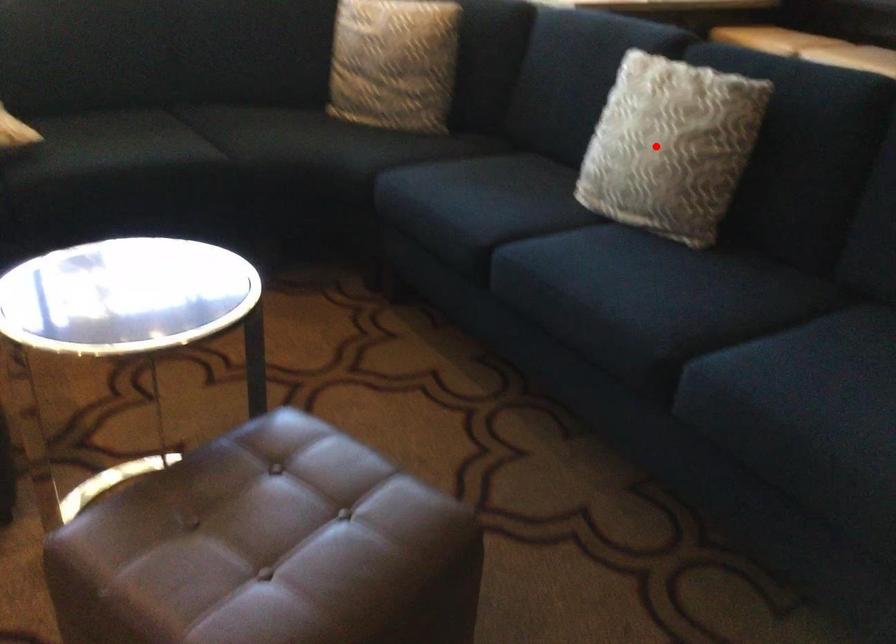
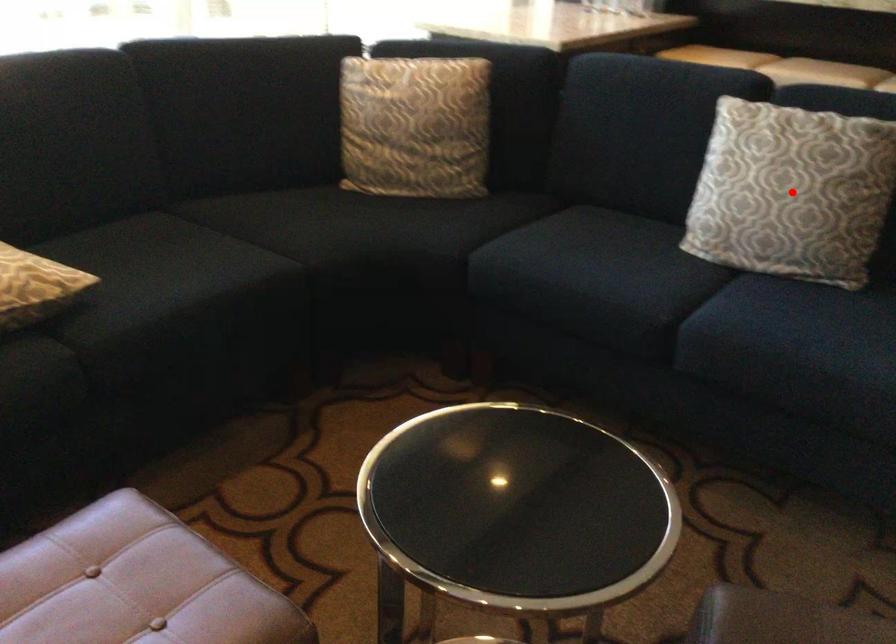
I am providing you with two images of the same scene from different viewpoints. A red point is marked on the first image and another point is marked on the second image. Does the point marked in image1 correspond to the same location as the one in image2?

Yes